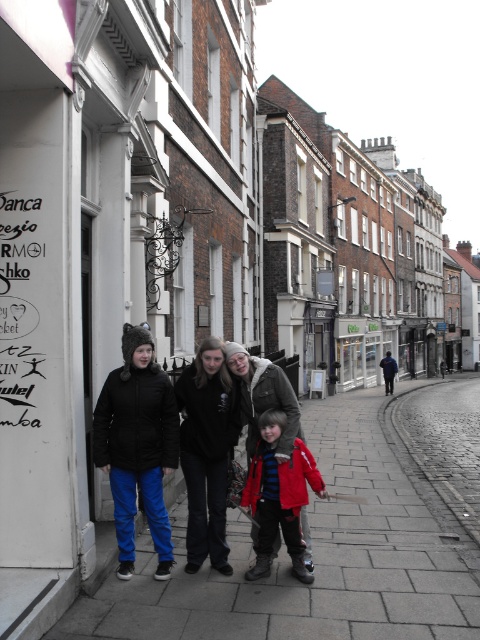
You are standing at the point marked as point (x=321, y=468). You want to walk to the nearest building entrance. The nearest building entrance is 30.65 feet away from you. Can you reach it within 10 seconds if you walk at a normal pace of 3 feet per second?

The distance between you and the nearest building entrance is 30.65 feet. At a normal walking speed of 3 feet per second, it would take approximately 10.2 seconds to reach it. Since 10.2 seconds is slightly more than 10 seconds, you cannot reach it within the time limit.

You are standing on the cobblestone street and want to walk from point A to point B. Point A is at coordinate point (252, 584) and point B is at coordinate point (264, 536). Which direction should you walk to move from point A to point B?

To move from point A at coordinate point (252, 584) to point B at coordinate point (264, 536), you should walk towards the northwest direction since point A is in front of point B.

You are a tourist standing on the cobblestone street in front of the historic buildings. You notice a point marked at coordinates (163, 442). What object or feature is located at that point?

The point at coordinates (163, 442) marks the location of the matte black jackets at center.